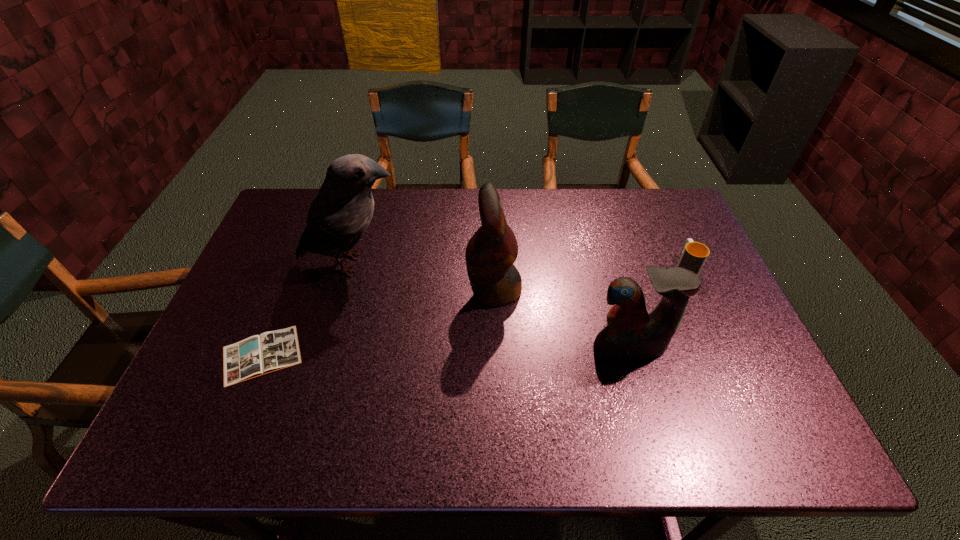
The height and width of the screenshot is (540, 960). I want to click on the leftmost parrot, so click(341, 211).

Locate an element on the screen. The image size is (960, 540). the second parrot from left to right is located at coordinates (490, 254).

You are a GUI agent. You are given a task and a screenshot of the screen. Output one action in this format:
    pyautogui.click(x=<x>, y=<y>)
    Task: Click on the rightmost parrot
    The width and height of the screenshot is (960, 540).
    Given the screenshot: What is the action you would take?
    pyautogui.click(x=631, y=333)

I want to click on the third tallest object, so click(631, 333).

The width and height of the screenshot is (960, 540). I want to click on the rightmost object, so click(x=694, y=254).

Find the location of a particular element. The height and width of the screenshot is (540, 960). the second shortest object is located at coordinates (694, 254).

Locate an element on the screen. book is located at coordinates (257, 355).

This screenshot has width=960, height=540. In order to click on vacant space located 0.320m on the front-facing side of the leftmost parrot in this screenshot , I will do `click(515, 264)`.

Identify the location of vacant region located on the face of the second parrot from right to left. This screenshot has width=960, height=540. (362, 290).

Where is `free region located 0.130m on the face of the second parrot from right to left`? The height and width of the screenshot is (540, 960). free region located 0.130m on the face of the second parrot from right to left is located at coordinates (420, 290).